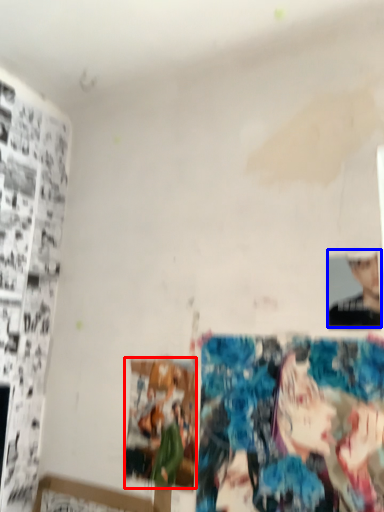
Question: Among these objects, which one is nearest to the camera, print (highlighted by a red box) or person (highlighted by a blue box)?

Choices:
 (A) print
 (B) person

Answer: (B)